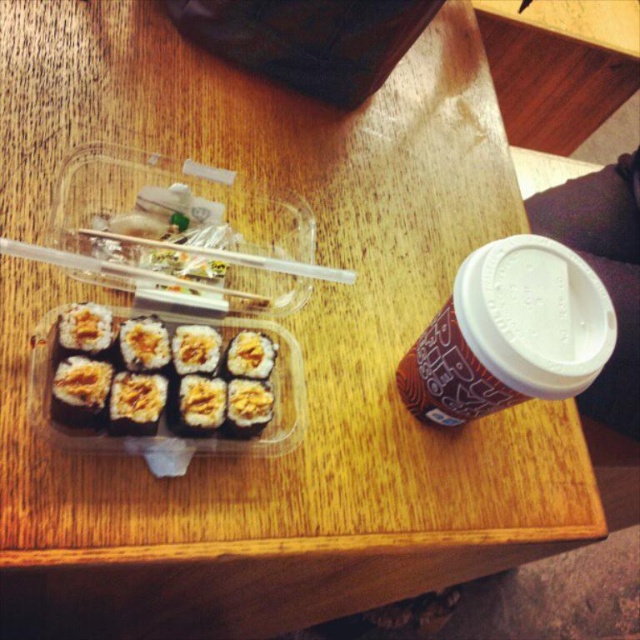
You are at the center of the table and want to pick up the matte brown cup at right. Which direction should you move your hand to reach it?

The matte brown cup at right is located at point (x=509, y=333), so you should move your hand to the right to reach it.